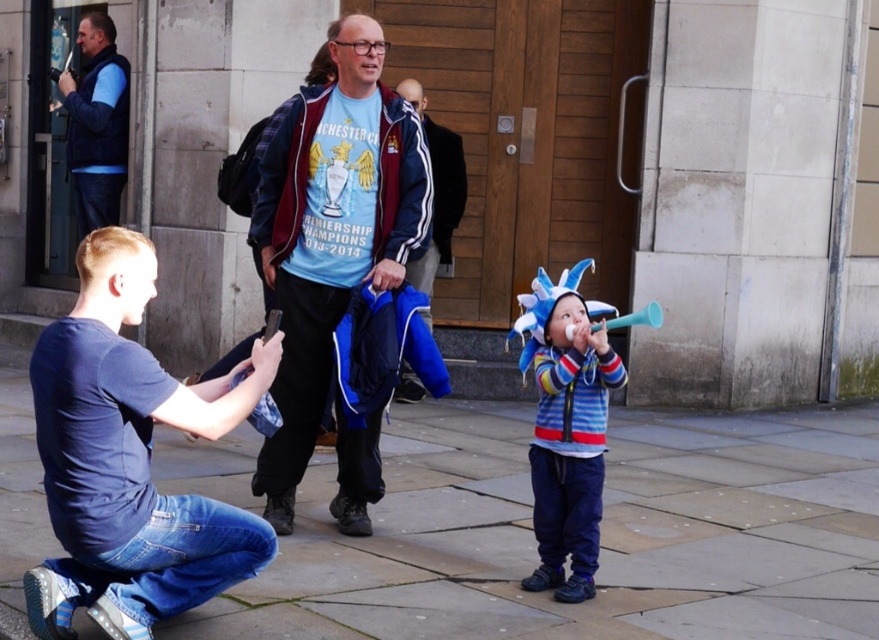
You are standing on the slate gray paving stone at center and want to throw a small ball to someone standing at the blue fabric jacket at center. Can you do this without the ball passing over any other objects in the scene?

The slate gray paving stone at center is closer to the viewer than the blue fabric jacket at center, so the ball would have to travel forward to reach the jacket. Since there are no objects mentioned between them in the scene description, the ball can be thrown directly without obstruction.

You are a delivery person who needs to place a small package on the slate gray paving stone at center. However, there is a blue fabric jacket at center nearby. Which object is smaller in size so you can safely place the package there?

The slate gray paving stone at center is smaller in size compared to the blue fabric jacket at center, so you can safely place the package there.